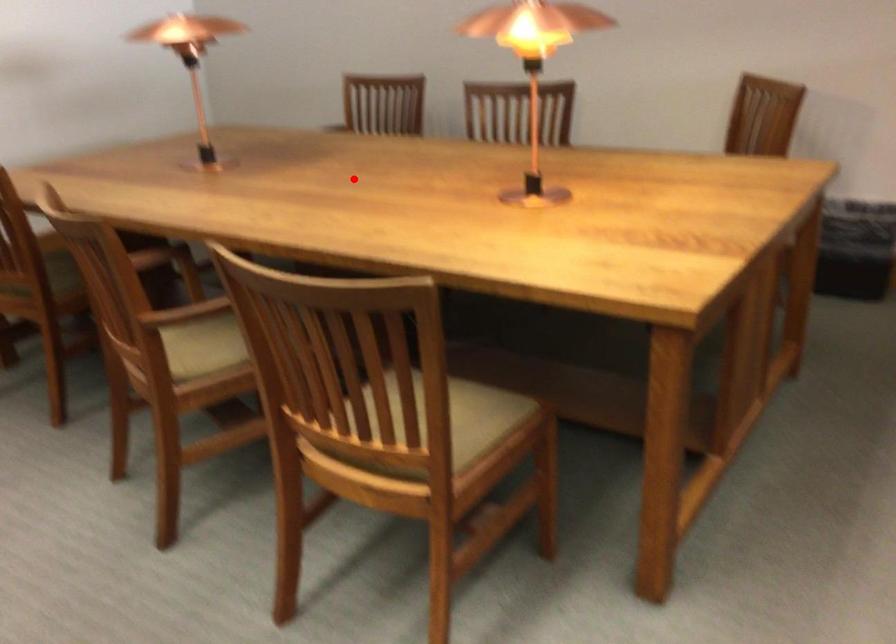
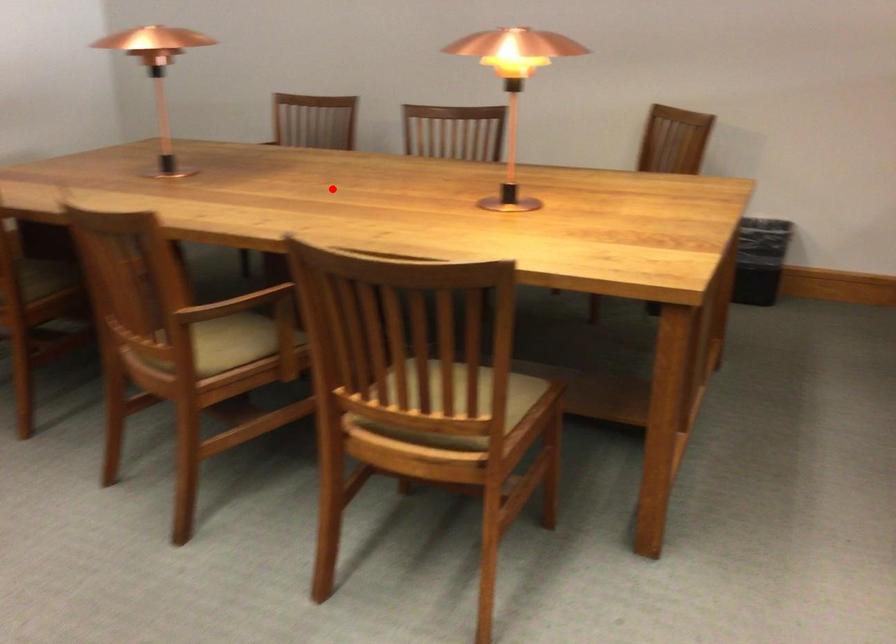
I am providing you with two images of the same scene from different viewpoints. A red point is marked on the first image and another point is marked on the second image. Are the points marked in image1 and image2 representing the same 3D position?

Yes